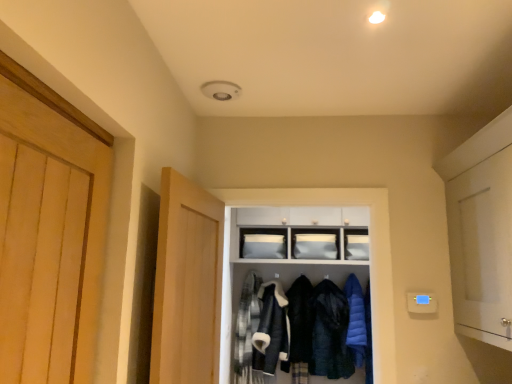
Question: Which direction should I rotate to look at white matte cabinet at center, arranged as the first cabinetry when ordered from the bottom, — up or down?

Choices:
 (A) down
 (B) up

Answer: (A)

Question: Which direction should I rotate to look at matte white cabinet at center, the 2th cabinetry in the bottom-to-top sequence, — up or down?

Choices:
 (A) up
 (B) down

Answer: (B)

Question: From the image's perspective, is white matte cabinet at right, the 2th door viewed from the left, over plaid fabric shirt at center, the 1th clothing viewed from the left?

Choices:
 (A) yes
 (B) no

Answer: (A)

Question: Is white matte cabinet at right, which is the first door in right-to-left order, far from plaid fabric shirt at center, the 1th clothing viewed from the left?

Choices:
 (A) no
 (B) yes

Answer: (B)

Question: Is white matte cabinet at right, which is the first door in right-to-left order, smaller than plaid fabric shirt at center, the 5th clothing when ordered from right to left?

Choices:
 (A) no
 (B) yes

Answer: (A)

Question: Does white matte cabinet at right, the 2th door viewed from the left, have a greater width compared to plaid fabric shirt at center, the 1th clothing viewed from the left?

Choices:
 (A) yes
 (B) no

Answer: (A)

Question: Is plaid fabric shirt at center, the 1th clothing viewed from the left, completely or partially inside white matte cabinet at right, which is the first door in right-to-left order?

Choices:
 (A) no
 (B) yes

Answer: (A)

Question: From the image's perspective, is white matte cabinet at right, the 2th door viewed from the left, located beneath plaid fabric shirt at center, the 1th clothing viewed from the left?

Choices:
 (A) yes
 (B) no

Answer: (B)

Question: Is dark blue quilted jacket at center, which ranks as the 4th clothing in left-to-right order, looking in the opposite direction of light wood door at center, marked as the 1th door in a left-to-right arrangement?

Choices:
 (A) yes
 (B) no

Answer: (B)

Question: From the image's perspective, does dark blue quilted jacket at center, which ranks as the 2th clothing in right-to-left order, appear higher than light wood door at center, the second door viewed from the right?

Choices:
 (A) yes
 (B) no

Answer: (B)

Question: Does dark blue quilted jacket at center, which ranks as the 4th clothing in left-to-right order, appear on the left side of light wood door at center, the second door viewed from the right?

Choices:
 (A) yes
 (B) no

Answer: (B)

Question: Would you say light wood door at center, marked as the 1th door in a left-to-right arrangement, is part of dark blue quilted jacket at center, which ranks as the 4th clothing in left-to-right order,'s contents?

Choices:
 (A) no
 (B) yes

Answer: (A)

Question: Does dark blue quilted jacket at center, which ranks as the 4th clothing in left-to-right order, have a smaller size compared to light wood door at center, marked as the 1th door in a left-to-right arrangement?

Choices:
 (A) yes
 (B) no

Answer: (A)

Question: Is dark blue quilted jacket at center, which ranks as the 4th clothing in left-to-right order, directly adjacent to light wood door at center, the second door viewed from the right?

Choices:
 (A) no
 (B) yes

Answer: (A)

Question: Considering the relative positions of dark blue wool coat at center, the 3th clothing in the right-to-left sequence, and light wood door at center, the second door viewed from the right, in the image provided, is dark blue wool coat at center, the 3th clothing in the right-to-left sequence, in front of light wood door at center, the second door viewed from the right,?

Choices:
 (A) yes
 (B) no

Answer: (B)